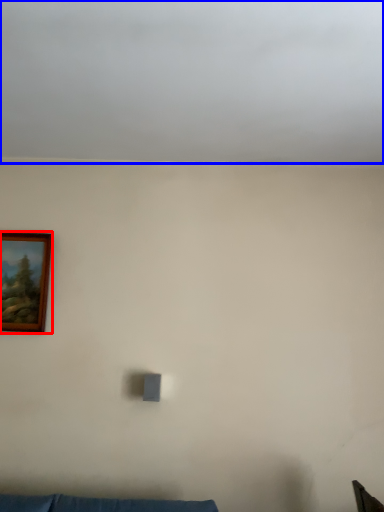
Question: Which point is closer to the camera, picture frame (highlighted by a red box) or cloud (highlighted by a blue box)?

Choices:
 (A) picture frame
 (B) cloud

Answer: (B)